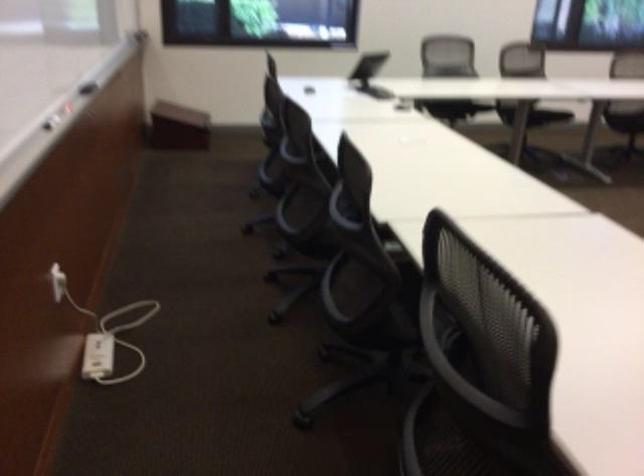
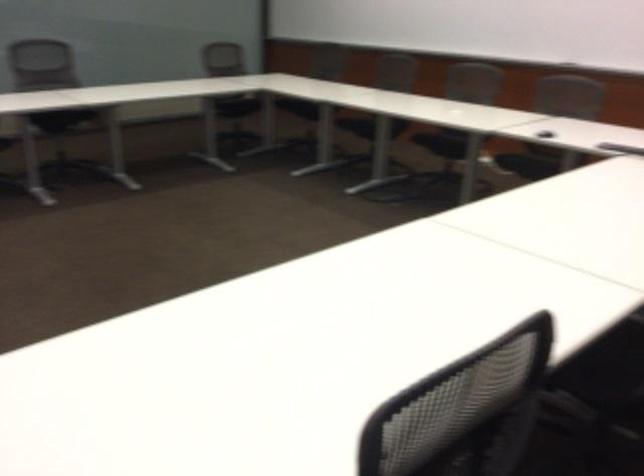
Question: In a continuous first-person perspective shot, in which direction is the camera moving?

Choices:
 (A) Left
 (B) Right
 (C) Forward
 (D) Backward

Answer: (D)